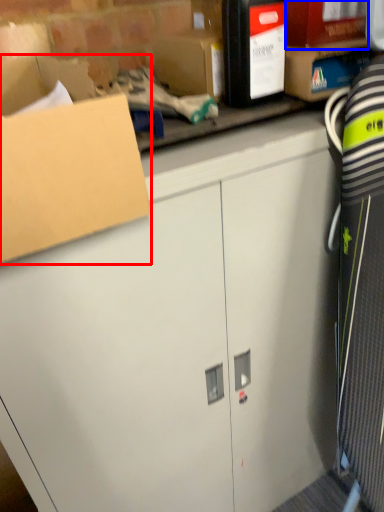
Question: Which point is closer to the camera, box (highlighted by a red box) or storage box (highlighted by a blue box)?

Choices:
 (A) box
 (B) storage box

Answer: (A)